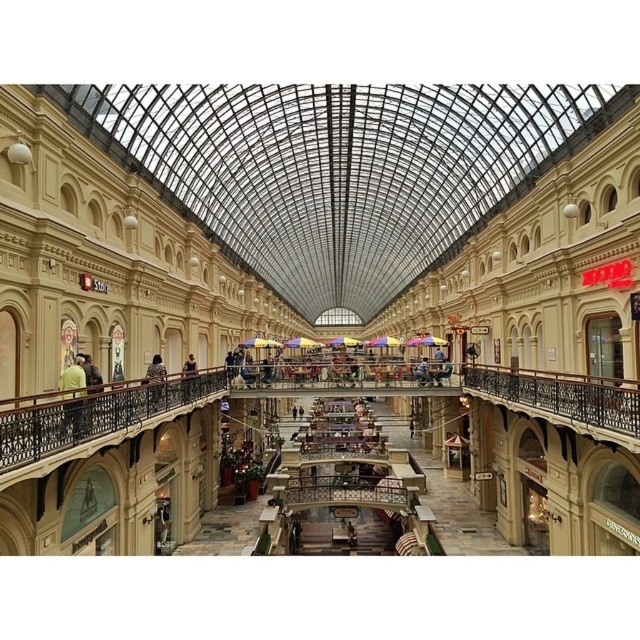
Question: Among these objects, which one is nearest to the camera?

Choices:
 (A) leopard print coat at center
 (B) dark blue shirt at center

Answer: (A)

Question: Can you confirm if beige stone mall at center is thinner than green fabric shirt at left?

Choices:
 (A) yes
 (B) no

Answer: (B)

Question: Which point is farther from the camera taking this photo?

Choices:
 (A) (61, 420)
 (B) (156, 360)
 (C) (333, 358)

Answer: (C)

Question: Is beige stone mall at center to the left of leopard print coat at center from the viewer's perspective?

Choices:
 (A) yes
 (B) no

Answer: (B)

Question: Which point appears closest to the camera in this image?

Choices:
 (A) (100, 429)
 (B) (64, 372)
 (C) (164, 365)

Answer: (A)

Question: Observing the image, what is the correct spatial positioning of green fabric shirt at left in reference to leopard print coat at center?

Choices:
 (A) below
 (B) above

Answer: (B)